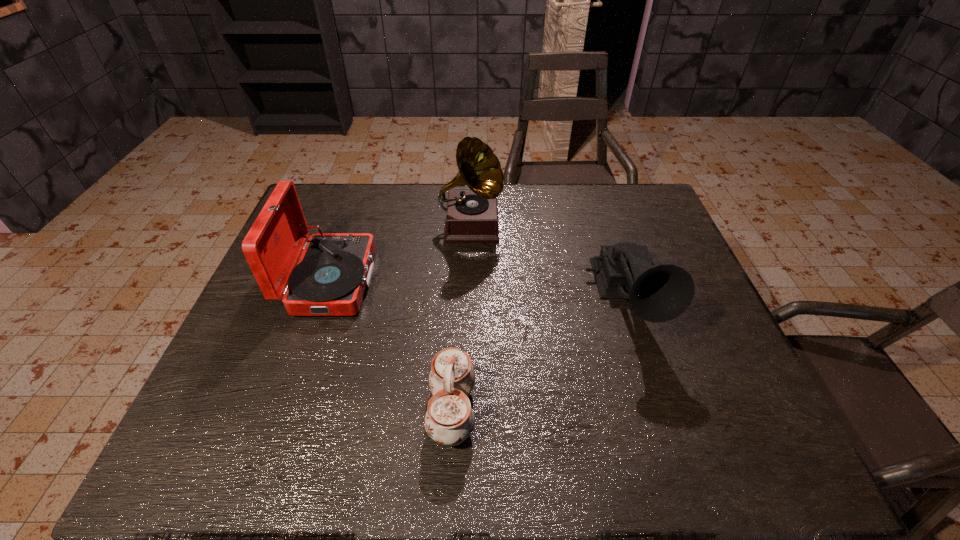
Identify the location of vacant space that is in between the rightmost phonograph_record and the shortest object. (539, 356).

The height and width of the screenshot is (540, 960). What are the coordinates of `vacant region between the rightmost phonograph_record and the second phonograph_record from right to left` in the screenshot? It's located at (548, 264).

Identify which object is the second nearest to the tallest phonograph_record. Please provide its 2D coordinates. Your answer should be formatted as a tuple, i.e. [(x, y)], where the tuple contains the x and y coordinates of a point satisfying the conditions above.

[(660, 293)]

Identify the location of the second closest object to the rightmost object. coord(449,420).

Point out which phonograph_record is positioned as the nearest to the chinaware. Please provide its 2D coordinates. Your answer should be formatted as a tuple, i.e. [(x, y)], where the tuple contains the x and y coordinates of a point satisfying the conditions above.

[(334, 269)]

Find the location of a particular element. the closest phonograph_record to the nearest object is located at coordinates (334, 269).

Where is `free region that satisfies the following two spatial constraints: 1. from the horn of the rightmost object; 2. by the handle of the shortest object`? The height and width of the screenshot is (540, 960). free region that satisfies the following two spatial constraints: 1. from the horn of the rightmost object; 2. by the handle of the shortest object is located at coordinates (660, 410).

Locate an element on the screen. Image resolution: width=960 pixels, height=540 pixels. vacant space that satisfies the following two spatial constraints: 1. from the horn of the tallest phonograph_record; 2. on the front-facing side of the leftmost phonograph_record is located at coordinates (469, 281).